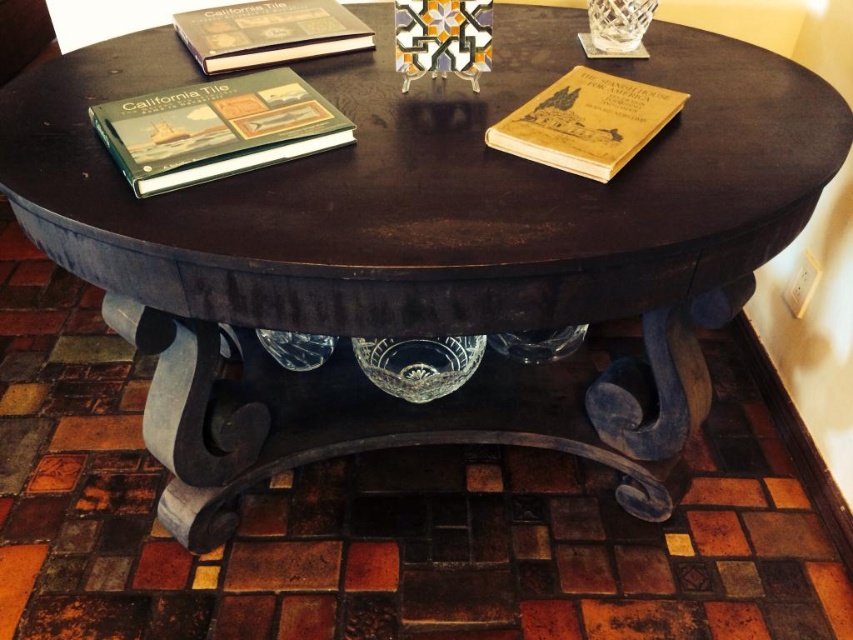
You are organizing books on a round wooden table with ornate blue legs. You need to place a new book between the yellow paper book at upper right and the hardcover book at upper left. According to their positions, where should you place the new book?

The yellow paper book at upper right is located below the hardcover book at upper left. To place the new book between them, position it between the yellow paper book at upper right and the hardcover book at upper left, ensuring it is above the yellow paper book and below the hardcover book at upper left.

You are standing at the center of the round wooden table and want to reach the green matte book at upper left. Which direction should you move towards?

You should move towards the upper left direction to reach the green matte book at upper left.